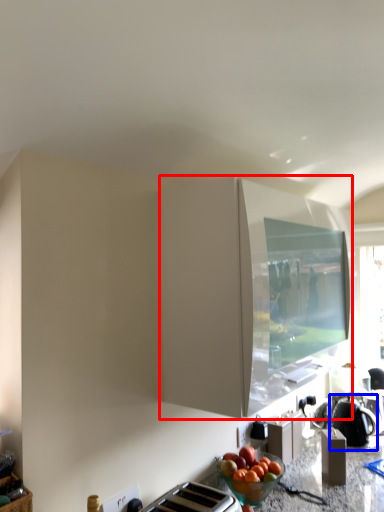
Question: Which object appears farthest to the camera in this image, cabinetry (highlighted by a red box) or kettle (highlighted by a blue box)?

Choices:
 (A) cabinetry
 (B) kettle

Answer: (B)